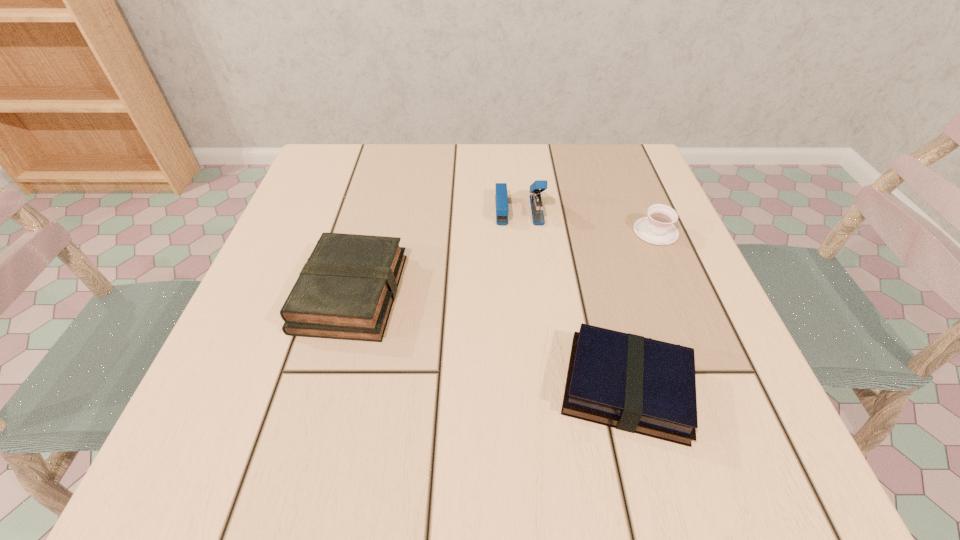
The width and height of the screenshot is (960, 540). In order to click on stapler in this screenshot , I will do `click(501, 198)`.

Identify the location of the leftmost object. (346, 289).

At what (x,y) coordinates should I click in order to perform the action: click on the shorter book. Please return your answer as a coordinate pair (x, y). This screenshot has width=960, height=540. Looking at the image, I should click on (640, 385).

You are a GUI agent. You are given a task and a screenshot of the screen. Output one action in this format:
    pyautogui.click(x=<x>, y=<y>)
    Task: Click on the teacup
    Image resolution: width=960 pixels, height=540 pixels.
    Given the screenshot: What is the action you would take?
    pyautogui.click(x=658, y=228)

What are the coordinates of `free location located on the back of the stapler` in the screenshot? It's located at (516, 176).

This screenshot has width=960, height=540. I want to click on free space located on the back of the leftmost object, so coord(379,190).

Locate an element on the screen. The width and height of the screenshot is (960, 540). free spot located on the back of the shorter book is located at coordinates (596, 270).

Locate an element on the screen. free spot located 0.210m on the handle side of the teacup is located at coordinates (626, 163).

Identify the location of free space located 0.190m on the handle side of the teacup. [628, 167].

Identify the location of blank space located 0.200m on the handle side of the teacup. This screenshot has height=540, width=960. (627, 165).